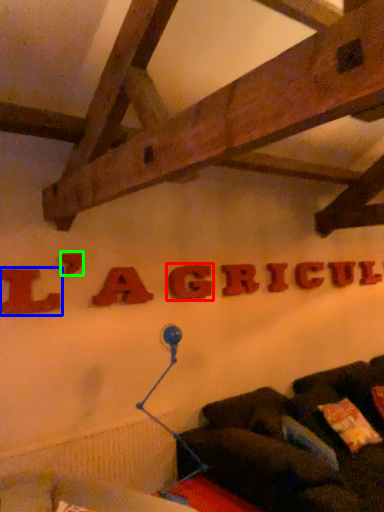
Question: Based on their relative distances, which object is farther from letter (highlighted by a red box)? Choose from letter (highlighted by a blue box) and letter (highlighted by a green box).

Choices:
 (A) letter
 (B) letter

Answer: (A)